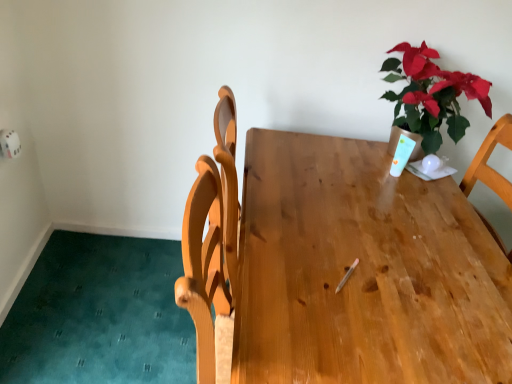
The image size is (512, 384). In order to click on wooden table at center in this screenshot , I will do `click(362, 271)`.

Image resolution: width=512 pixels, height=384 pixels. What do you see at coordinates (362, 271) in the screenshot?
I see `wooden table at center` at bounding box center [362, 271].

The height and width of the screenshot is (384, 512). Describe the element at coordinates (431, 95) in the screenshot. I see `green leafy plant at upper right` at that location.

What are the coordinates of `green leafy plant at upper right` in the screenshot? It's located at (431, 95).

Where is `wooden table at center`? wooden table at center is located at coordinates (362, 271).

Considering the positions of objects wooden table at center and green leafy plant at upper right in the image provided, who is more to the left, wooden table at center or green leafy plant at upper right?

Positioned to the left is wooden table at center.

Which is behind, wooden table at center or green leafy plant at upper right?

Positioned behind is green leafy plant at upper right.

Which is closer to the camera, (285, 216) or (388, 58)?

Positioned in front is point (285, 216).

From the image's perspective, would you say wooden table at center is positioned over green leafy plant at upper right?

No, from the image's perspective, wooden table at center is not over green leafy plant at upper right.

From a real-world perspective, does wooden table at center stand above green leafy plant at upper right?

Actually, wooden table at center is physically below green leafy plant at upper right in the real world.

Does wooden table at center have a lesser width compared to green leafy plant at upper right?

No.

Who is taller, wooden table at center or green leafy plant at upper right?

wooden table at center.

Does wooden table at center have a smaller size compared to green leafy plant at upper right?

No, wooden table at center is not smaller than green leafy plant at upper right.

Can green leafy plant at upper right be found inside wooden table at center?

Definitely not — green leafy plant at upper right is not inside wooden table at center.

Is wooden table at center not close to green leafy plant at upper right?

They are positioned close to each other.

Is wooden table at center oriented towards green leafy plant at upper right?

No, wooden table at center is not facing towards green leafy plant at upper right.

The image size is (512, 384). I want to click on houseplant that is above the wooden table at center (from a real-world perspective), so click(x=431, y=95).

Considering the relative positions of green leafy plant at upper right and wooden table at center in the image provided, is green leafy plant at upper right to the left of wooden table at center from the viewer's perspective?

In fact, green leafy plant at upper right is to the right of wooden table at center.

Is green leafy plant at upper right further to the viewer compared to wooden table at center?

Yes, it is behind wooden table at center.

Is point (448, 124) positioned after point (477, 329)?

Yes, point (448, 124) is farther from viewer.

From the image's perspective, is green leafy plant at upper right above or below wooden table at center?

green leafy plant at upper right is situated higher than wooden table at center in the image.

From a real-world perspective, who is located higher, green leafy plant at upper right or wooden table at center?

green leafy plant at upper right.

Which object is wider, green leafy plant at upper right or wooden table at center?

wooden table at center is wider.

Considering the relative sizes of green leafy plant at upper right and wooden table at center in the image provided, is green leafy plant at upper right shorter than wooden table at center?

Yes, green leafy plant at upper right is shorter than wooden table at center.

Who is smaller, green leafy plant at upper right or wooden table at center?

With smaller size is green leafy plant at upper right.

Would you say green leafy plant at upper right is outside wooden table at center?

Yes, green leafy plant at upper right is not within wooden table at center.

Is green leafy plant at upper right far from wooden table at center?

They are positioned close to each other.

Does green leafy plant at upper right turn towards wooden table at center?

No, green leafy plant at upper right is not turned towards wooden table at center.

How different are the orientations of green leafy plant at upper right and wooden table at center in degrees?

The angular difference between green leafy plant at upper right and wooden table at center is 90.5 degrees.

How distant is green leafy plant at upper right from wooden table at center?

The distance of green leafy plant at upper right from wooden table at center is 18.16 inches.

Locate an element on the screen. This screenshot has height=384, width=512. table in front of the green leafy plant at upper right is located at coordinates (362, 271).

You are a GUI agent. You are given a task and a screenshot of the screen. Output one action in this format:
    pyautogui.click(x=<x>, y=<y>)
    Task: Click on the table below the green leafy plant at upper right (from the image's perspective)
    The width and height of the screenshot is (512, 384).
    Given the screenshot: What is the action you would take?
    [362, 271]

Locate an element on the screen. The width and height of the screenshot is (512, 384). houseplant behind the wooden table at center is located at coordinates (431, 95).